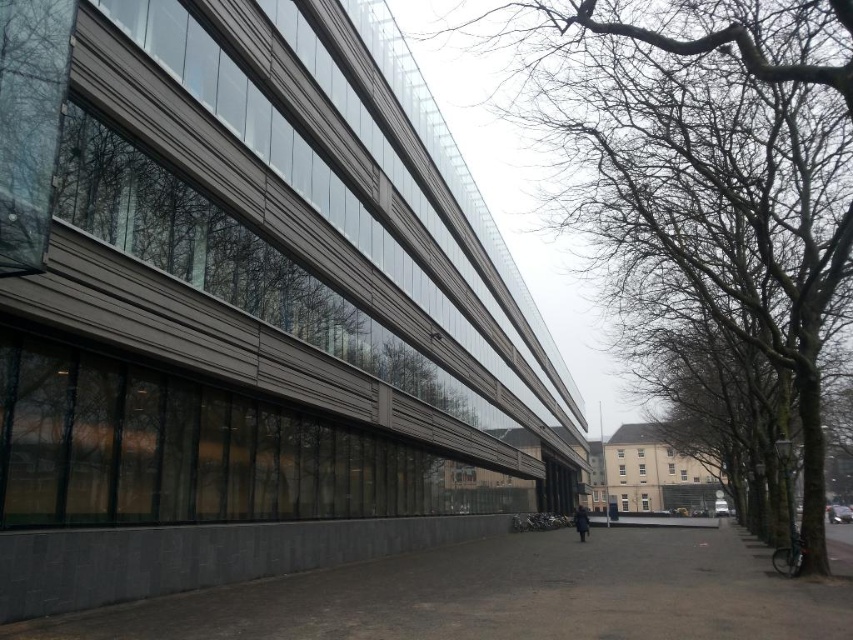
You are standing at the entrance of the modern building and want to take a photo of the bare branches at upper right. If your camera has a maximum focus distance of 7 meters, will it be able to capture the branches clearly?

The distance between the bare branches at upper right and the camera is 7.16 meters, which exceeds the camera maximum focus distance of 7 meters. Therefore, the camera cannot capture the branches clearly.

You are standing at the entrance of the modern building and see the bare branches at upper right and the dark gray coat at center. If you want to reach both objects, which one would you need to walk further to get to?

The bare branches at upper right is 15.93 meters away from dark gray coat at center, so you would need to walk further to reach the bare branches at upper right since it is farther away than the dark gray coat at center.